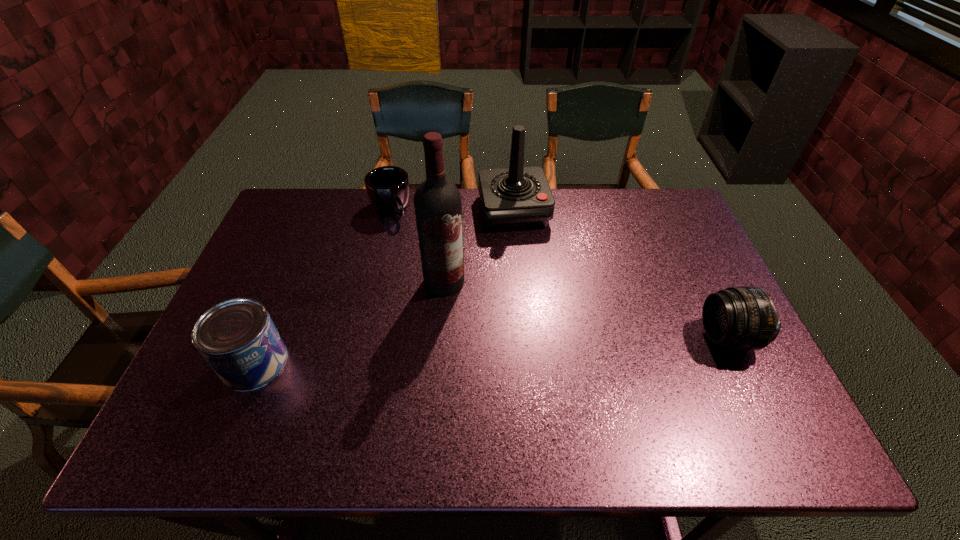
This screenshot has height=540, width=960. What are the coordinates of `mug that is at the far edge` in the screenshot? It's located at (388, 188).

Identify the location of joystick that is at the far edge. (516, 197).

Find the location of a particular element. Image resolution: width=960 pixels, height=540 pixels. object that is positioned at the near edge is located at coordinates (237, 337).

This screenshot has width=960, height=540. Identify the location of object at the left edge. (237, 337).

I want to click on object that is at the right edge, so click(744, 317).

Find the location of a particular element. object that is at the near left corner is located at coordinates (237, 337).

In the image, there is a desktop. Where is `vacant space at the far edge`? This screenshot has height=540, width=960. vacant space at the far edge is located at coordinates (555, 194).

The height and width of the screenshot is (540, 960). I want to click on vacant space at the near edge, so click(404, 394).

Locate an element on the screen. The image size is (960, 540). free space at the right edge of the desktop is located at coordinates (702, 329).

The image size is (960, 540). I want to click on free location at the far left corner, so click(x=296, y=201).